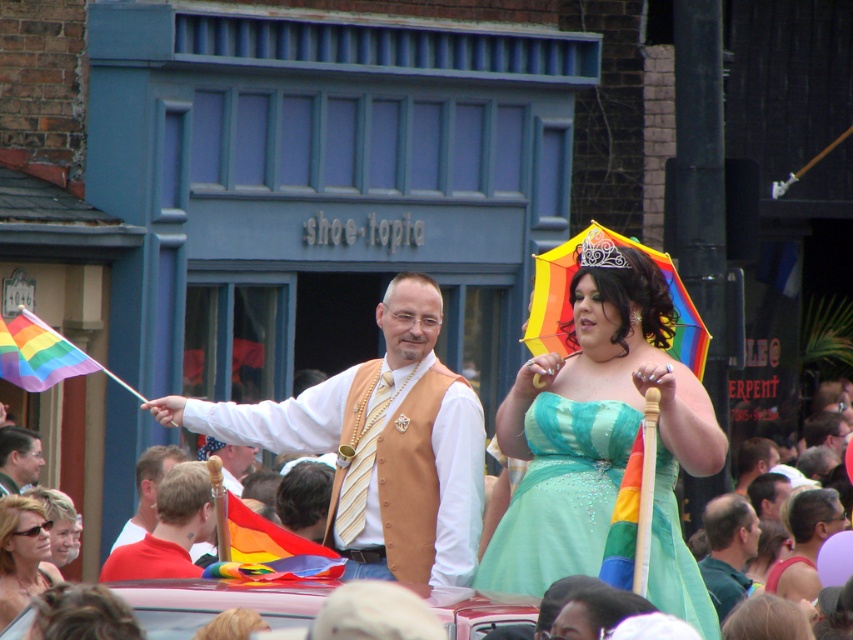
You are standing in the middle of the parade route and see two points marked in the scene. Which point is closer to you, point [840,504] or point [12,452]?

Point [12,452] is closer to you because it is less further to the viewer than point [840,504].